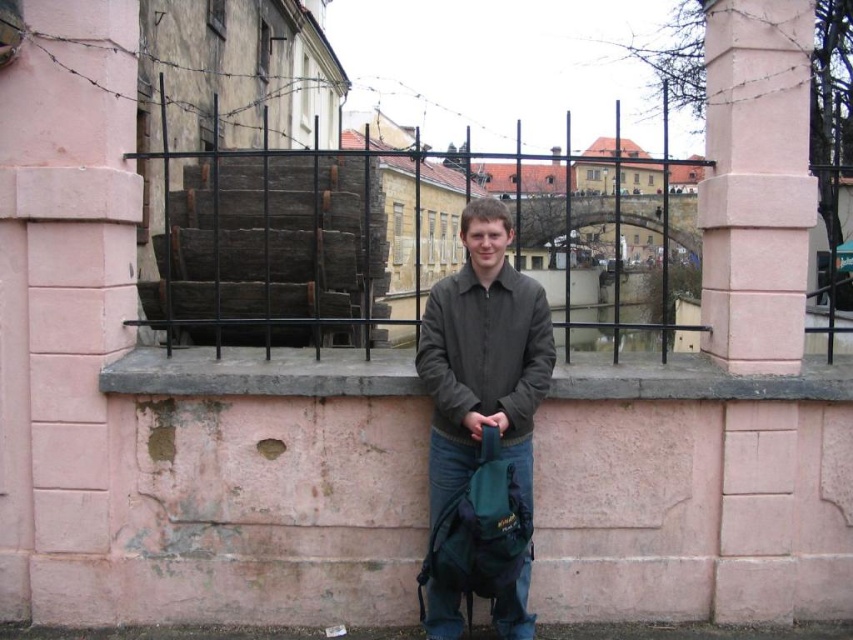
Looking at this image, you are a fashion designer analyzing the image. You need to locate the dark gray fabric jacket at center. Where exactly is it positioned in the image?

The dark gray fabric jacket at center is located at point 0.552 in the x coordinate and 0.566 in the y coordinate.

You are a painter wanting to capture the scene. You need to decide which object to focus on first based on their heights. Which one is taller between the pink stone pillar at center right and the pink concrete ledge at center?

The pink stone pillar at center right is taller than the pink concrete ledge at center.